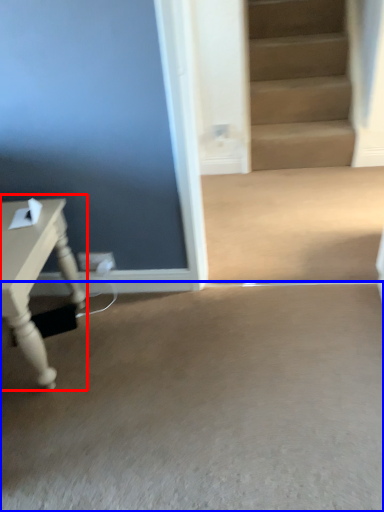
Question: Which object appears closest to the camera in this image, table (highlighted by a red box) or concrete (highlighted by a blue box)?

Choices:
 (A) table
 (B) concrete

Answer: (B)